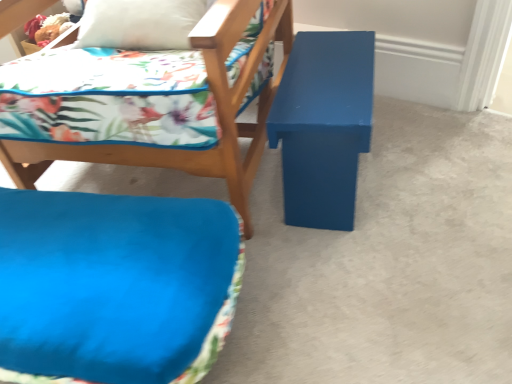
Question: In terms of size, does matte blue bench at right appear bigger or smaller than blue matte bench at center?

Choices:
 (A) small
 (B) big

Answer: (A)

Question: From a real-world perspective, is matte blue bench at right above or below blue matte bench at center?

Choices:
 (A) below
 (B) above

Answer: (B)

Question: Which of these objects is positioned closest to the blue fabric cushion at lower left?

Choices:
 (A) blue matte bench at center
 (B) matte blue cushion at center
 (C) matte blue bench at right

Answer: (B)

Question: Which of these objects is positioned farthest from the matte blue bench at right?

Choices:
 (A) matte blue cushion at center
 (B) blue fabric cushion at lower left
 (C) blue matte bench at center

Answer: (B)